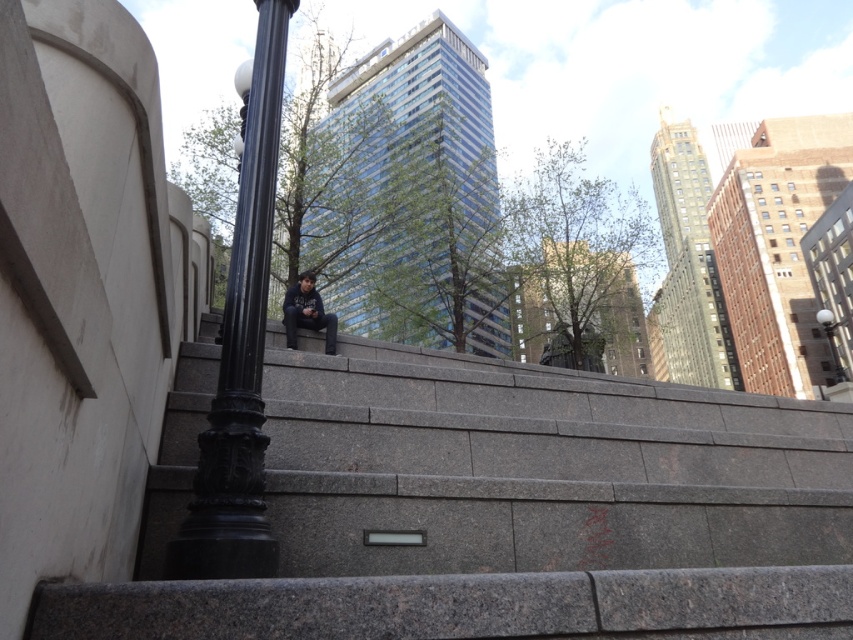
You are a delivery person with a cart that is 2 meters wide. You need to move from the gray concrete stairs at center to the black polished metal pole at left. Is there enough space for your cart to pass between them?

The distance between the gray concrete stairs at center and the black polished metal pole at left is 2.15 meters. Since the cart is 2 meters wide, there is enough space for the cart to pass between them as the distance is slightly larger than the cart width.

You are a photographer trying to capture both the dark blue hoodie at center and the black metal lamp post at upper right in the same frame. Based on their sizes in the image, which object would appear smaller in the photo?

The dark blue hoodie at center would appear smaller in the photo because it is not as tall as the black metal lamp post at upper right.

You are a delivery person trying to navigate through the plaza. You need to deliver a package to the person sitting on the gray concrete stairs at center. However, there is a black polished metal pole at left blocking your path. Can you go around the pole to reach the stairs?

The gray concrete stairs at center is below the black polished metal pole at left, so you can go around the pole to reach the stairs since the stairs are positioned lower and the pole is in front of them.